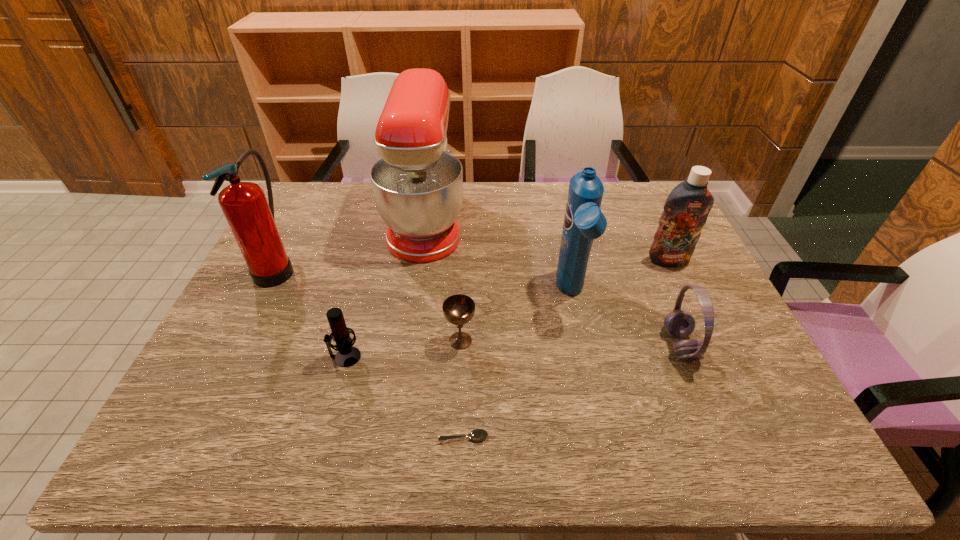
Select which object is the second closest to the left shampoo. Please provide its 2D coordinates. Your answer should be formatted as a tuple, i.e. [(x, y)], where the tuple contains the x and y coordinates of a point satisfying the conditions above.

[(686, 209)]

Where is `object that is the fourth closest one to the farther shampoo`? object that is the fourth closest one to the farther shampoo is located at coordinates (459, 309).

Locate an element on the screen. free space that satisfies the following two spatial constraints: 1. on the front-facing side of the left shampoo; 2. on the right side of the mixer is located at coordinates (416, 294).

Identify the location of free spot that satisfies the following two spatial constraints: 1. on the front-facing side of the mixer; 2. on the back side of the chalice. (408, 341).

This screenshot has width=960, height=540. What are the coordinates of `free space in the image that satisfies the following two spatial constraints: 1. on the front label of the fifth shortest object; 2. on the headband and ear cups of the headset` in the screenshot? It's located at (709, 346).

Find the location of a particular element. This screenshot has width=960, height=540. vacant area that satisfies the following two spatial constraints: 1. on the back side of the microphone; 2. on the right side of the taller shampoo is located at coordinates (363, 294).

The image size is (960, 540). I want to click on vacant point that satisfies the following two spatial constraints: 1. on the front-facing side of the mixer; 2. on the left side of the shortest object, so click(394, 437).

Identify the location of free point that satisfies the following two spatial constraints: 1. on the back side of the chalice; 2. on the right side of the sixth object from left to right. This screenshot has height=540, width=960. (463, 294).

Find the location of `blank space that satisfies the following two spatial constraints: 1. on the front-facing side of the seventh tallest object; 2. on the left side of the mixer`. blank space that satisfies the following two spatial constraints: 1. on the front-facing side of the seventh tallest object; 2. on the left side of the mixer is located at coordinates (408, 341).

Find the location of a particular element. free space that satisfies the following two spatial constraints: 1. on the front-facing side of the mixer; 2. on the front side of the leftmost object is located at coordinates (420, 267).